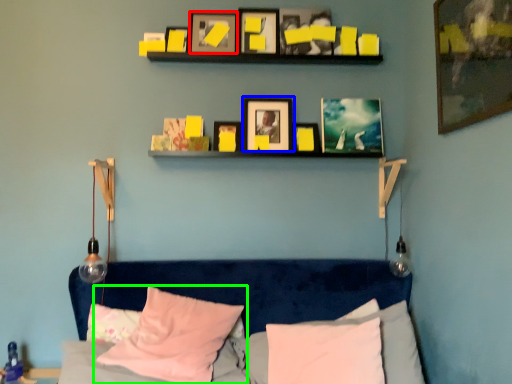
Question: Estimate the real-world distances between objects in this image. Which object is farther from picture frame (highlighted by a red box), picture frame (highlighted by a blue box) or pillow (highlighted by a green box)?

Choices:
 (A) picture frame
 (B) pillow

Answer: (B)